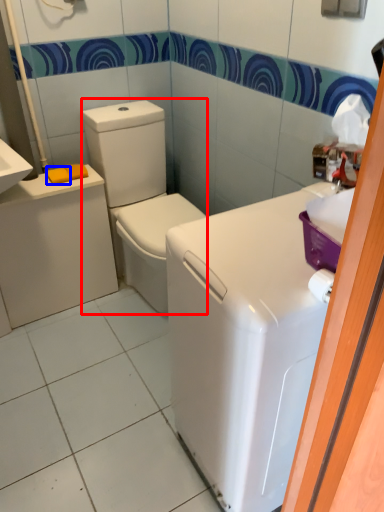
Question: Which of the following is the farthest to the observer, washer (highlighted by a red box) or soap (highlighted by a blue box)?

Choices:
 (A) washer
 (B) soap

Answer: (B)